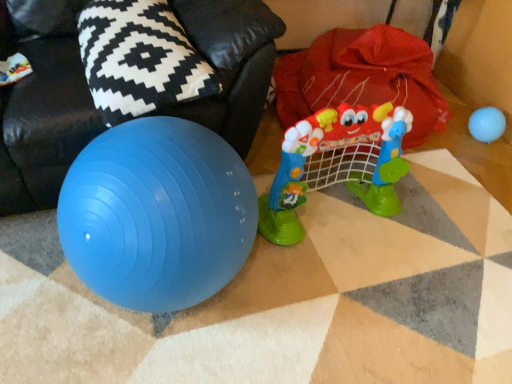
The width and height of the screenshot is (512, 384). I want to click on vacant space in front of blue rubber ball at upper right, positioned as the 1th toy in right-to-left order, so click(x=483, y=160).